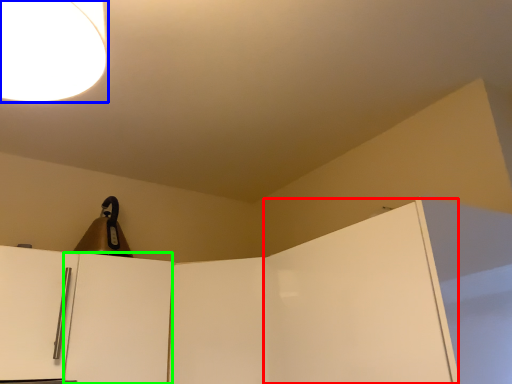
Question: Considering the real-world distances, which object is farthest from door (highlighted by a red box)? lamp (highlighted by a blue box) or door (highlighted by a green box)?

Choices:
 (A) lamp
 (B) door

Answer: (A)